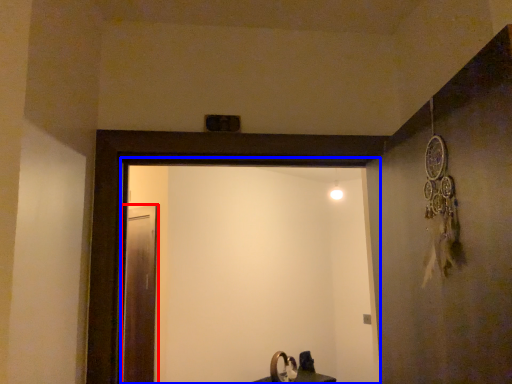
Question: Which point is closer to the camera, screen door (highlighted by a red box) or screen door (highlighted by a blue box)?

Choices:
 (A) screen door
 (B) screen door

Answer: (B)